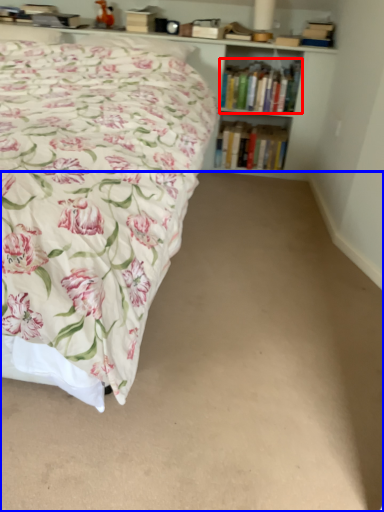
Question: Among these objects, which one is nearest to the camera, book (highlighted by a red box) or plain (highlighted by a blue box)?

Choices:
 (A) book
 (B) plain

Answer: (B)